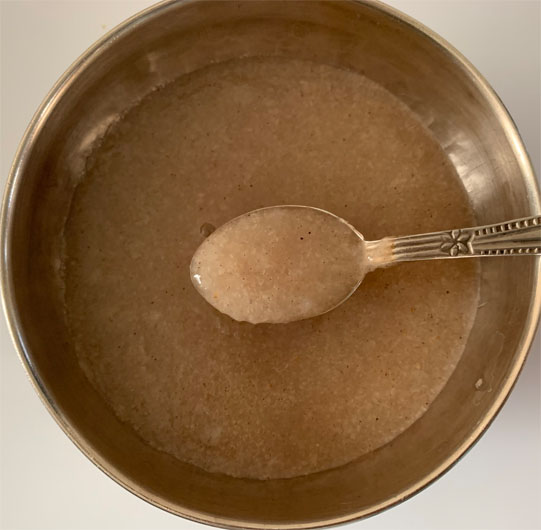
I want to click on metal spoon, so click(x=500, y=242).